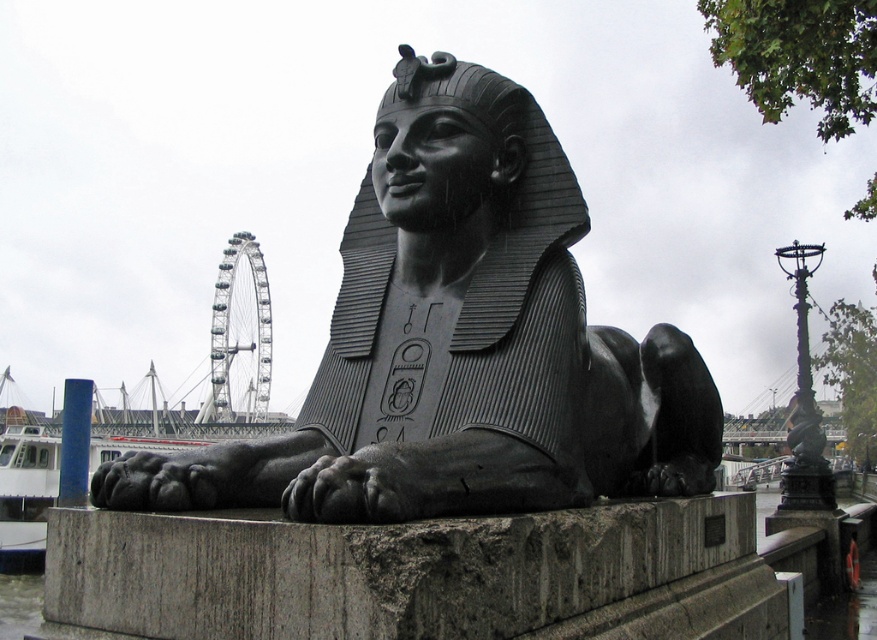
Can you confirm if black polished stone sphinx at center is positioned to the right of gray stone pedestal at lower center?

In fact, black polished stone sphinx at center is to the left of gray stone pedestal at lower center.

Is point (343, 518) positioned after point (467, 548)?

No, it is not.

The image size is (877, 640). I want to click on black polished stone sphinx at center, so click(x=460, y=342).